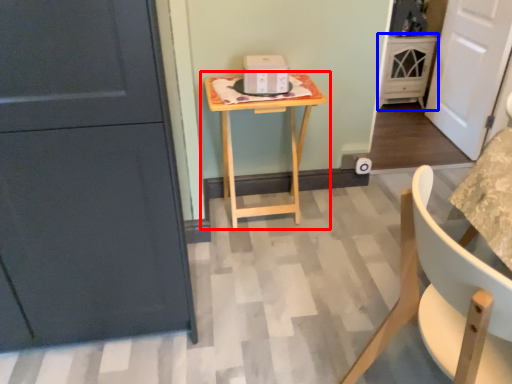
Question: Which of the following is the farthest to the observer, table (highlighted by a red box) or cabinetry (highlighted by a blue box)?

Choices:
 (A) table
 (B) cabinetry

Answer: (B)